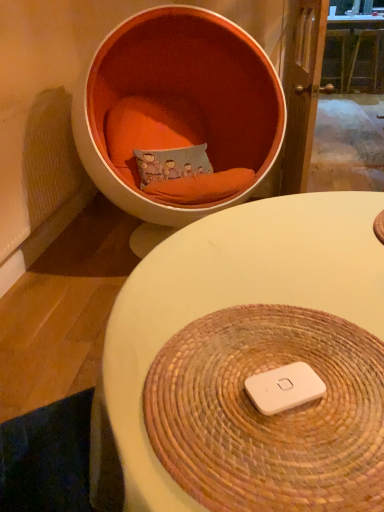
Question: From a real-world perspective, is white matte/ipod at center physically below orange fabric chair at upper left?

Choices:
 (A) no
 (B) yes

Answer: (A)

Question: From a real-world perspective, is white matte/ipod at center on top of orange fabric chair at upper left?

Choices:
 (A) no
 (B) yes

Answer: (B)

Question: Is white matte/ipod at center facing towards orange fabric chair at upper left?

Choices:
 (A) no
 (B) yes

Answer: (A)

Question: Considering the relative sizes of white matte/ipod at center and orange fabric chair at upper left in the image provided, is white matte/ipod at center shorter than orange fabric chair at upper left?

Choices:
 (A) no
 (B) yes

Answer: (B)

Question: Is there a large distance between white matte/ipod at center and orange fabric chair at upper left?

Choices:
 (A) yes
 (B) no

Answer: (A)

Question: Does white matte/ipod at center have a lesser width compared to orange fabric chair at upper left?

Choices:
 (A) no
 (B) yes

Answer: (B)

Question: Is orange fabric chair at upper left to the left of wooden table at upper center, which appears as the 2th table when viewed from the front, from the viewer's perspective?

Choices:
 (A) no
 (B) yes

Answer: (B)

Question: Is orange fabric chair at upper left to the right of wooden table at upper center, which appears as the 2th table when viewed from the front, from the viewer's perspective?

Choices:
 (A) no
 (B) yes

Answer: (A)

Question: Is the position of orange fabric chair at upper left more distant than that of wooden table at upper center, the 2th table positioned from the bottom?

Choices:
 (A) yes
 (B) no

Answer: (B)

Question: Does orange fabric chair at upper left have a smaller size compared to wooden table at upper center, the 1th table from the top?

Choices:
 (A) no
 (B) yes

Answer: (A)

Question: Is orange fabric chair at upper left shorter than wooden table at upper center, the 1th table from the top?

Choices:
 (A) yes
 (B) no

Answer: (B)

Question: Is orange fabric chair at upper left in contact with wooden table at upper center, placed as the first table when sorted from back to front?

Choices:
 (A) no
 (B) yes

Answer: (A)

Question: Does white matte/ipod at center have a smaller size compared to white woven placemat at center, which ranks as the 2th table in right-to-left order?

Choices:
 (A) yes
 (B) no

Answer: (A)